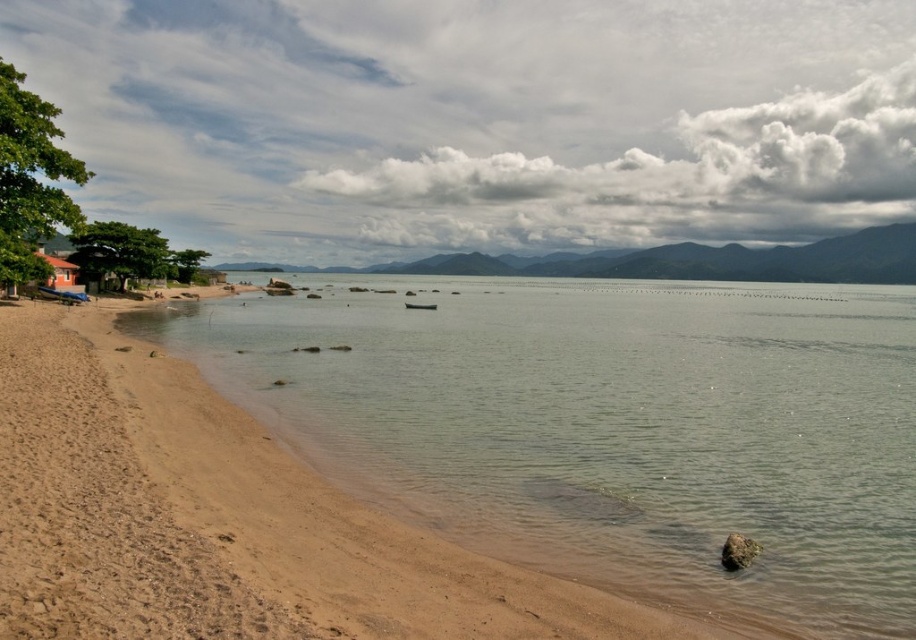
You are standing on the beach and want to take a photo of the clear water at beach left and the brown wooden hut at lower left. Which object should you focus on first if you want to capture both in one shot without moving the camera?

You should focus on the clear water at beach left first because it is closer to the viewer than the brown wooden hut at lower left, allowing both to be in focus if the depth of field is sufficient.

You are standing on the beach and want to take a photo that includes both the clear water at beach left and the brown wooden hut at lower left. Which object should appear larger in the photo?

The clear water at beach left should appear larger in the photo because it is taller than the brown wooden hut at lower left.

You are standing at the point marked as point (609,426) on the beach. What is the nearest object to you?

The nearest object to you is clear water at beach left, which is located at point (609,426).